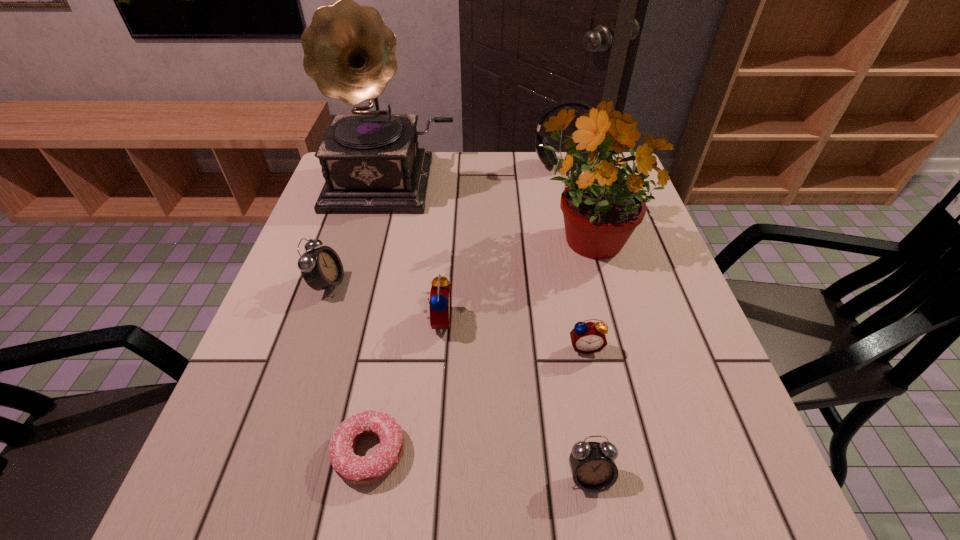
Locate an element on the screen. empty location between the golden record player and the third farthest alarm clock is located at coordinates (489, 265).

Image resolution: width=960 pixels, height=540 pixels. Identify the location of free space between the headset and the farthest alarm clock. (445, 225).

Where is `free spot between the bigger red alarm clock and the record player`? This screenshot has width=960, height=540. free spot between the bigger red alarm clock and the record player is located at coordinates (415, 252).

Find the location of a particular element. empty location between the nearest alarm clock and the second tallest object is located at coordinates (588, 356).

The height and width of the screenshot is (540, 960). Identify the location of empty space that is in between the second nearest alarm clock and the seventh shortest object. (587, 291).

Locate an element on the screen. This screenshot has width=960, height=540. blank region between the leftmost alarm clock and the flowerpot is located at coordinates (458, 260).

Find the location of `vacant space in between the bigger white alarm clock and the fifth farthest object`. vacant space in between the bigger white alarm clock and the fifth farthest object is located at coordinates (383, 303).

Locate which object ranks third in proximity to the tallest object. Please provide its 2D coordinates. Your answer should be formatted as a tuple, i.e. [(x, y)], where the tuple contains the x and y coordinates of a point satisfying the conditions above.

[(547, 157)]

Identify the location of object that is the nearest to the doughnut. (440, 294).

This screenshot has width=960, height=540. What are the coordinates of `the third closest alarm clock relative to the golden record player` in the screenshot? It's located at (586, 338).